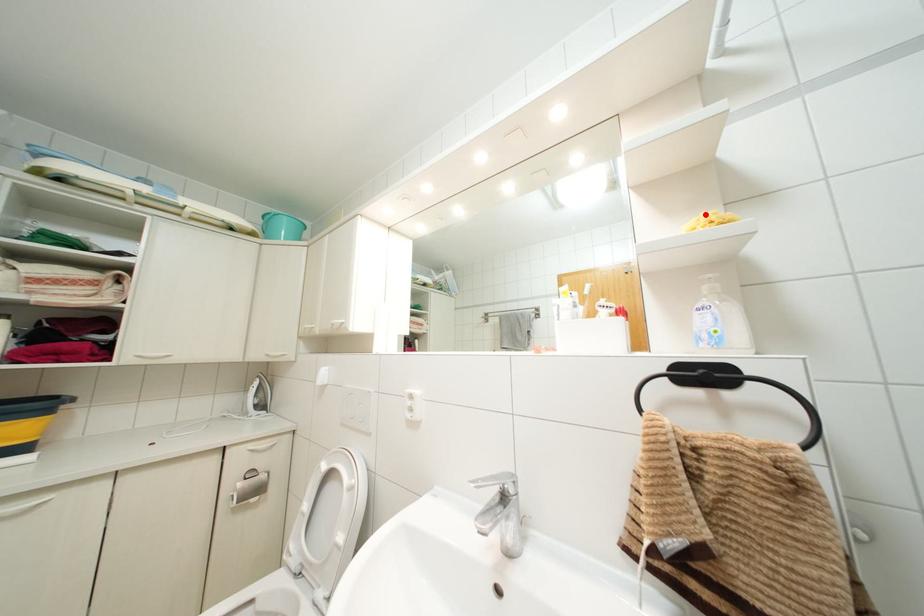
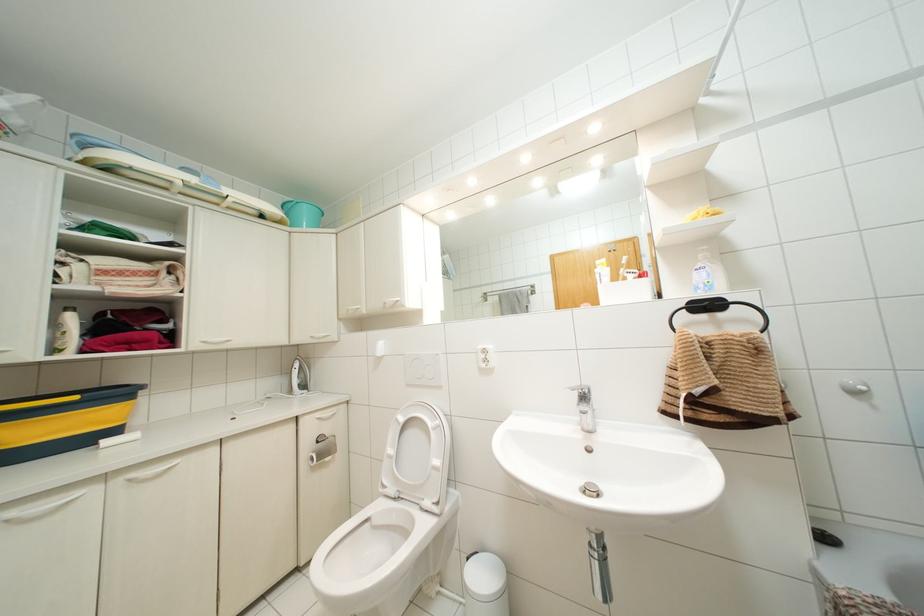
Find the pixel in the second image that matches the highlighted location in the first image.

(701, 208)